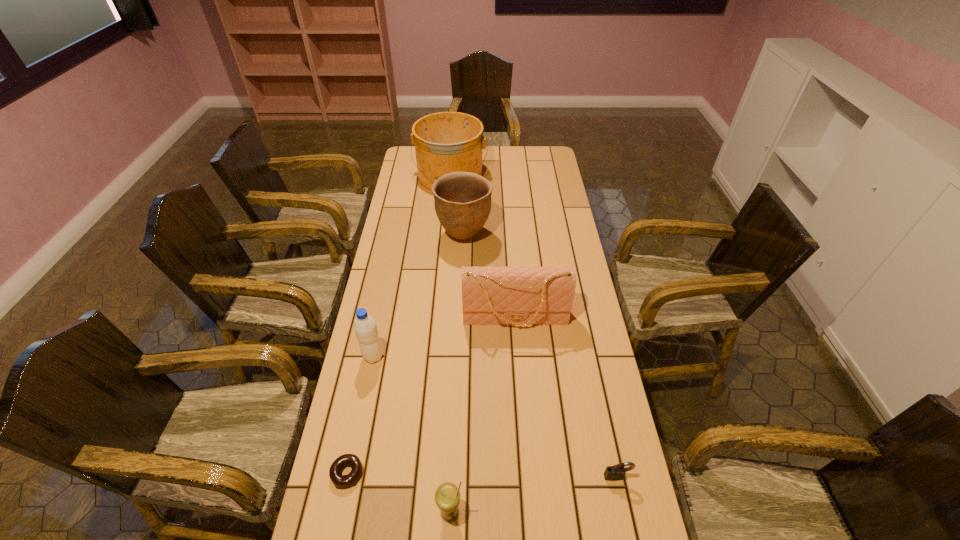
Identify the location of handbag that is at the right edge. The image size is (960, 540). (504, 295).

Identify the location of padlock that is at the right edge. The image size is (960, 540). (616, 472).

The width and height of the screenshot is (960, 540). Identify the location of object at the far left corner. (445, 142).

This screenshot has height=540, width=960. What are the coordinates of `blank space at the far edge` in the screenshot? It's located at (502, 161).

In order to click on vacant space at the left edge in this screenshot , I will do (x=343, y=449).

Where is `blank space at the right edge of the desktop`? This screenshot has height=540, width=960. blank space at the right edge of the desktop is located at coordinates (545, 261).

Find the location of `empty location between the bucket and the water bottle`. empty location between the bucket and the water bottle is located at coordinates (412, 266).

The height and width of the screenshot is (540, 960). I want to click on blank region between the fifth tallest object and the water bottle, so click(412, 434).

Locate an element on the screen. This screenshot has height=540, width=960. vacant area that lies between the nearest object and the pottery is located at coordinates (457, 374).

This screenshot has height=540, width=960. Identify the location of vacant space in between the handbag and the doughnut. (431, 396).